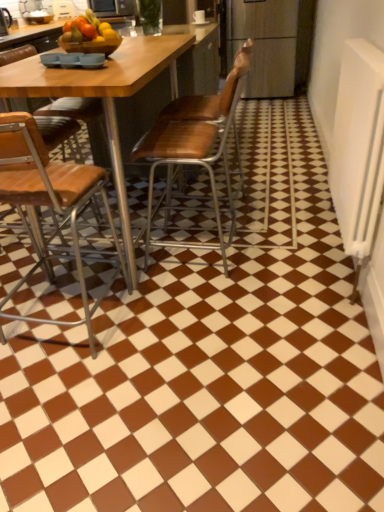
Find the location of a particular element. free point below wooden seat at center, which is counted as the 3th chair, starting from the left (from a real-world perspective) is located at coordinates (207, 204).